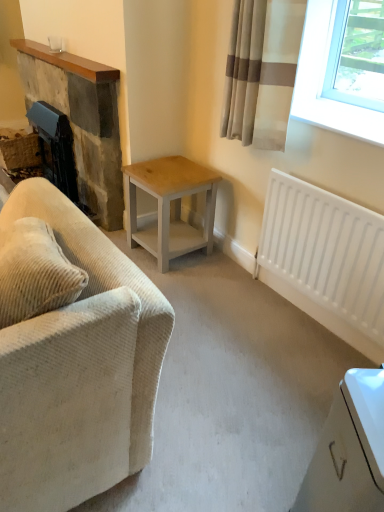
Question: Is point (49, 55) closer or farther from the camera than point (117, 347)?

Choices:
 (A) closer
 (B) farther

Answer: (B)

Question: Is rustic stone fireplace at left bigger or smaller than beige corduroy couch at left?

Choices:
 (A) big
 (B) small

Answer: (B)

Question: Estimate the real-world distances between objects in this image. Which object is closer to the rustic stone fireplace at left?

Choices:
 (A) white matte radiator at lower right
 (B) light wood/grey painted table at center
 (C) beige fabric curtain at upper right
 (D) beige corduroy couch at left

Answer: (B)

Question: Considering the real-world distances, which object is farthest from the white matte radiator at lower right?

Choices:
 (A) light wood/grey painted table at center
 (B) beige fabric curtain at upper right
 (C) rustic stone fireplace at left
 (D) beige corduroy couch at left

Answer: (C)